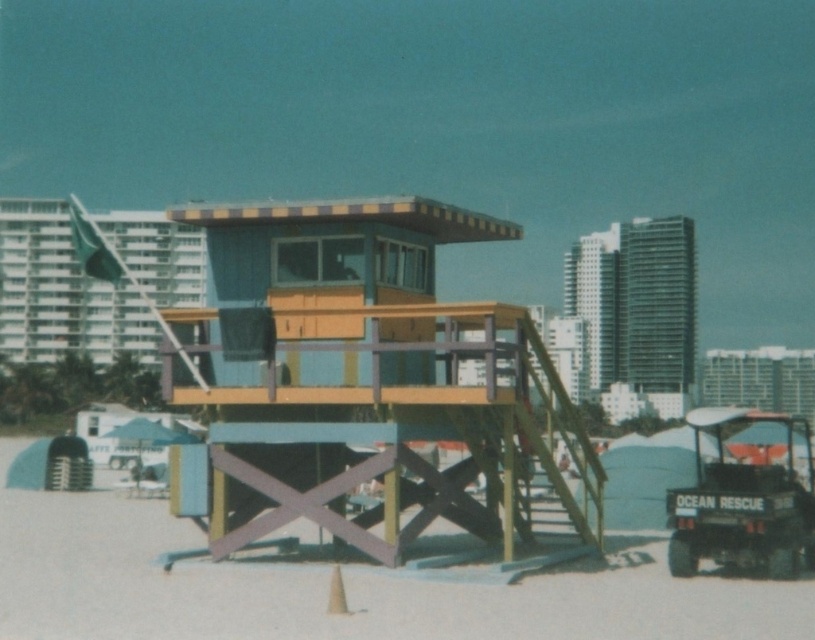
You are a visitor at the beach and want to know if the wooden lifeguard tower at center is larger than the white sand at center. Can you confirm this?

The wooden lifeguard tower at center is bigger than white sand at center, so yes, it is larger.

You are a beachgoer trying to set up a beach umbrella. You have a 2 meter wide umbrella. The wooden lifeguard tower at center and the white sand at center are in your way. Can you place your umbrella between them?

The wooden lifeguard tower at center is thinner than white sand at center. Since the wooden lifeguard tower at center is thinner than the white sand at center, there might be enough space between them to place your 2 meter wide umbrella. However, the exact distance isn not provided, so it depends on the actual spacing between them.